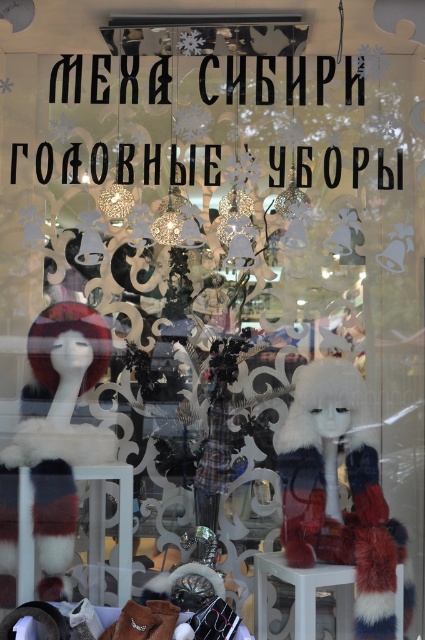
From the picture: Is white fur hat at center to the right of velvet red hat at left from the viewer's perspective?

Indeed, white fur hat at center is positioned on the right side of velvet red hat at left.

Is point (363, 412) closer to camera compared to point (36, 481)?

That is False.

Who is more forward, (x=357, y=529) or (x=87, y=317)?

Positioned in front is point (x=357, y=529).

At what (x,y) coordinates should I click in order to perform the action: click on white fur hat at center. Please return your answer as a coordinate pair (x, y). This screenshot has height=640, width=425. Looking at the image, I should click on (337, 493).

Does white fur hat at center have a greater width compared to white glossy stool at center?

Correct, the width of white fur hat at center exceeds that of white glossy stool at center.

Is white fur hat at center above white glossy stool at center?

Yes.

Is point (391, 541) in front of point (302, 593)?

No, it is not.

Locate an element on the screen. white fur hat at center is located at coordinates (337, 493).

Can you confirm if velvet red hat at left is smaller than white glossy stool at center?

No, velvet red hat at left is not smaller than white glossy stool at center.

Identify the location of velvet red hat at left. Image resolution: width=425 pixels, height=640 pixels. (53, 444).